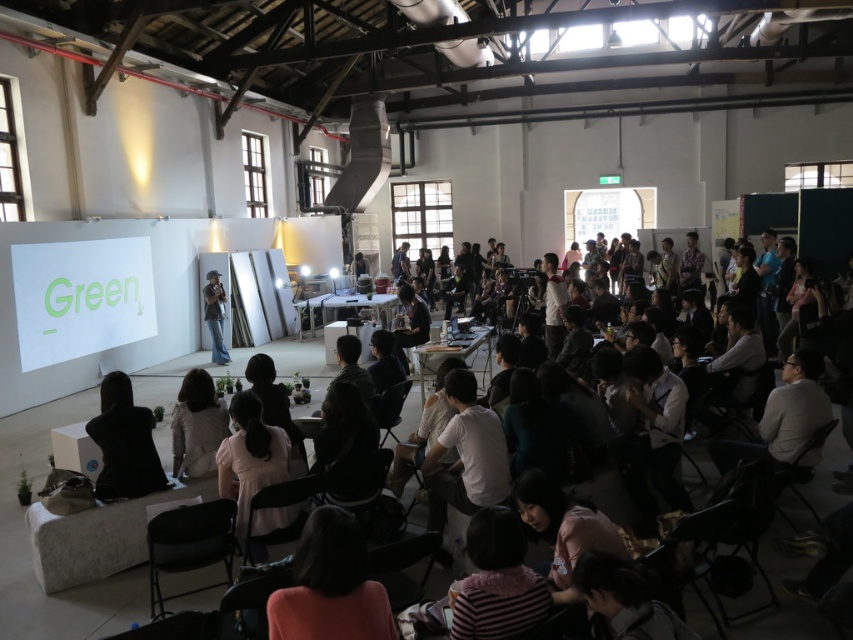
You are a photographer at the event and want to capture both the light brown fabric jacket at lower center and the dark gray fabric jacket at center in a single photo. Which jacket should you position on the left side of your frame to ensure both are included?

You should position the light brown fabric jacket at lower center on the left side of your frame since it is already on the left side of the dark gray fabric jacket at center, ensuring both are included in the photo.

You are an attendee at the event and want to adjust your seating to get a better view. You notice the black fabric at lower left and denim jeans at center. Which object is closer to the front of the stage?

The black fabric at lower left is closer to the front of the stage because it is in front of the denim jeans at center.

You are standing at the front of the stage and want to move to one of the two points marked in the image. Which point, point [189,403] or point [360,392], is closer to you?

Point [189,403] is closer to the viewer than point [360,392], so you should move to point [189,403] as it is nearer to your current position at the front of the stage.